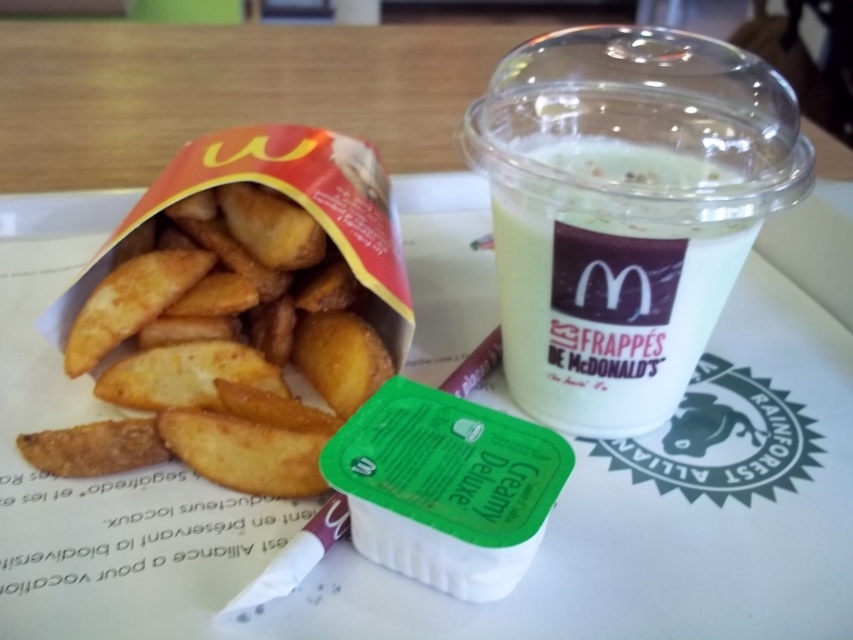
Question: Is golden crispy fries at left wider than white opaque cup at center?

Choices:
 (A) yes
 (B) no

Answer: (A)

Question: Which object appears closest to the camera in this image?

Choices:
 (A) golden crispy fries at left
 (B) white opaque cup at center

Answer: (B)

Question: Which point is farther from the camera taking this photo?

Choices:
 (A) coord(154,269)
 (B) coord(572,403)

Answer: (A)

Question: Does golden crispy fries at left appear on the right side of white opaque cup at center?

Choices:
 (A) no
 (B) yes

Answer: (A)

Question: Does golden crispy fries at left appear under white opaque cup at center?

Choices:
 (A) no
 (B) yes

Answer: (B)

Question: Which object appears closest to the camera in this image?

Choices:
 (A) golden crispy fries at left
 (B) white opaque cup at center

Answer: (B)